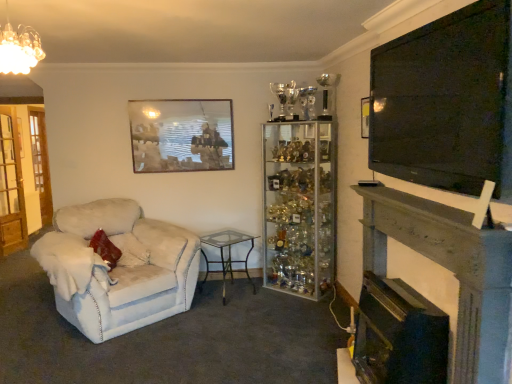
Question: Does clear glass trophy cabinet at center appear on the left side of wooden glass door at left, marked as the first glass door in a front-to-back arrangement?

Choices:
 (A) no
 (B) yes

Answer: (A)

Question: Can you confirm if clear glass trophy cabinet at center is thinner than wooden glass door at left, which appears as the second glass door when viewed from the left?

Choices:
 (A) no
 (B) yes

Answer: (A)

Question: Is clear glass trophy cabinet at center turned away from wooden glass door at left, marked as the first glass door in a front-to-back arrangement?

Choices:
 (A) yes
 (B) no

Answer: (B)

Question: Is wooden glass door at left, the second glass door in the back-to-front sequence, inside clear glass trophy cabinet at center?

Choices:
 (A) yes
 (B) no

Answer: (B)

Question: Does clear glass trophy cabinet at center have a smaller size compared to wooden glass door at left, marked as the first glass door in a front-to-back arrangement?

Choices:
 (A) no
 (B) yes

Answer: (A)

Question: From the image's perspective, would you say clear glass trophy cabinet at center is positioned over wooden glass door at left, marked as the first glass door in a front-to-back arrangement?

Choices:
 (A) yes
 (B) no

Answer: (B)

Question: From a real-world perspective, does wooden glass door at left, which appears as the second glass door when viewed from the left, sit lower than clear glass table at center?

Choices:
 (A) yes
 (B) no

Answer: (B)

Question: Is wooden glass door at left, which appears as the second glass door when viewed from the left, taller than clear glass table at center?

Choices:
 (A) no
 (B) yes

Answer: (B)

Question: Does wooden glass door at left, marked as the first glass door in a front-to-back arrangement, have a smaller size compared to clear glass table at center?

Choices:
 (A) yes
 (B) no

Answer: (A)

Question: Is wooden glass door at left, positioned as the 1th glass door in right-to-left order, closer to camera compared to clear glass table at center?

Choices:
 (A) no
 (B) yes

Answer: (A)

Question: From a real-world perspective, is wooden glass door at left, the second glass door in the back-to-front sequence, physically above clear glass table at center?

Choices:
 (A) no
 (B) yes

Answer: (B)

Question: Is wooden glass door at left, the second glass door in the back-to-front sequence, not near clear glass table at center?

Choices:
 (A) no
 (B) yes

Answer: (B)

Question: Is black glossy fireplace at lower right, placed as the second fireplace when sorted from right to left, oriented away from clear glass trophy cabinet at center?

Choices:
 (A) yes
 (B) no

Answer: (B)